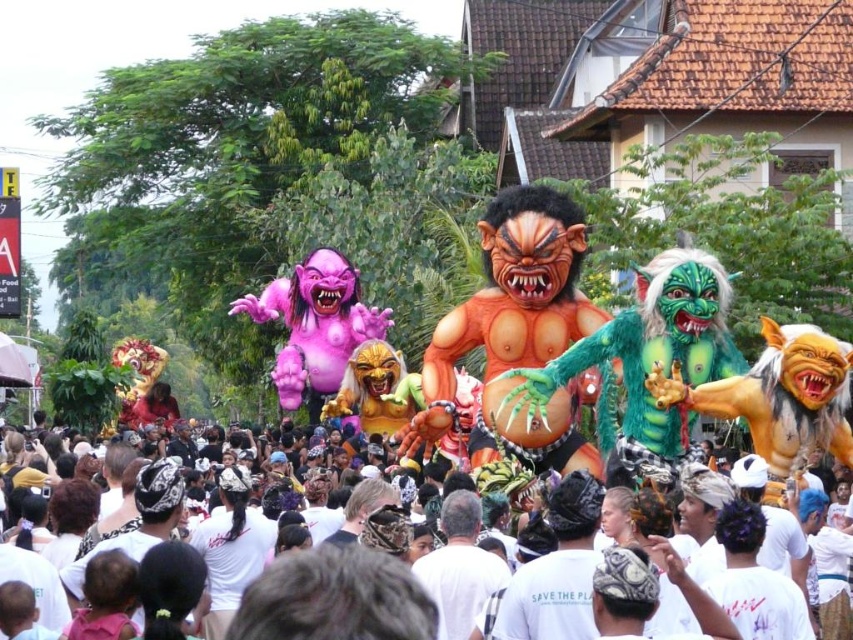
Is point (538, 308) in front of point (704, 461)?

No, it is not.

How far apart are multicolored fabric float at center and white cotton crowd at center?

They are 7.81 meters apart.

Where is `multicolored fabric float at center`? The height and width of the screenshot is (640, 853). multicolored fabric float at center is located at coordinates (573, 333).